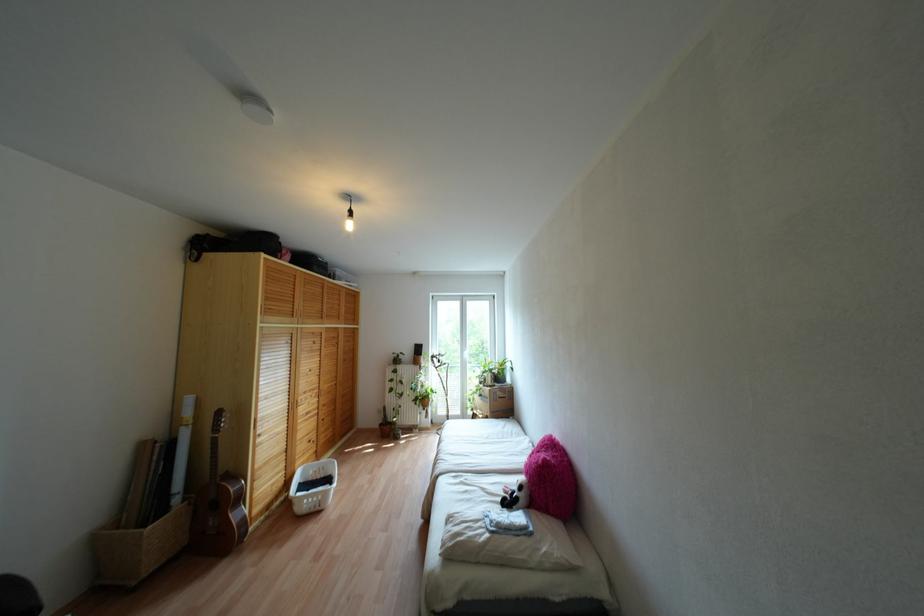
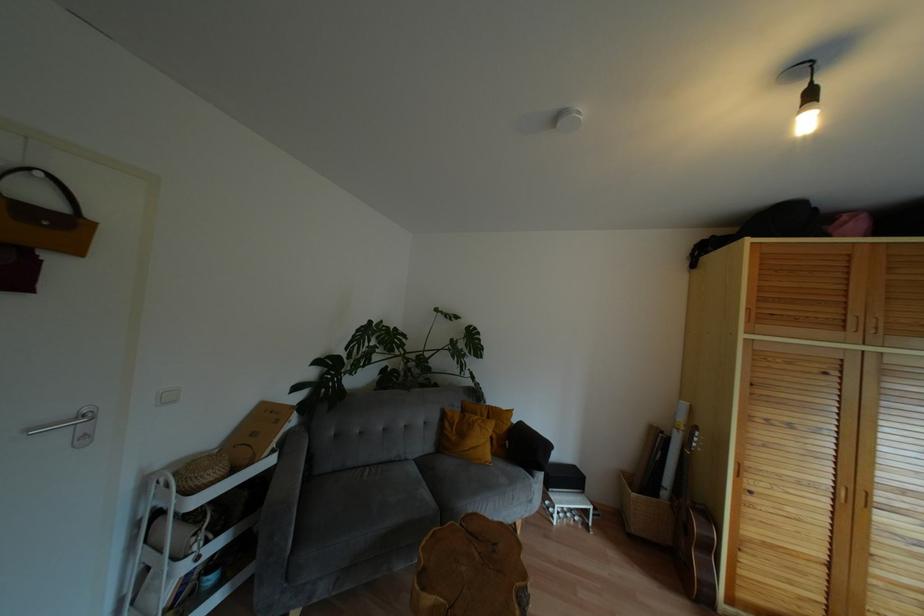
Find the pixel in the second image that matches the point at 238,498 in the first image.

(710, 548)